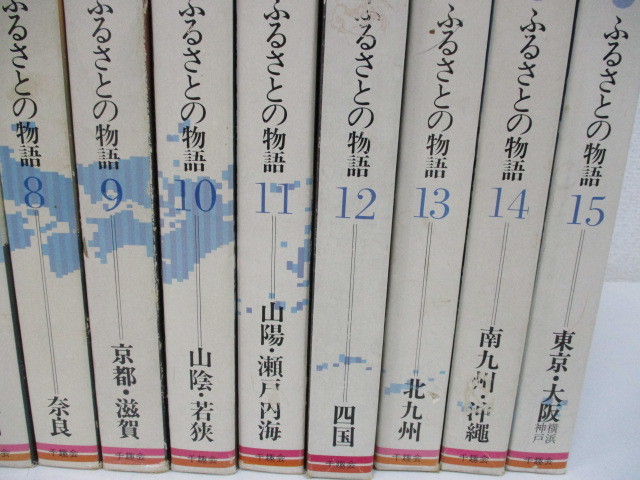
Identify the location of book 8. Image resolution: width=640 pixels, height=480 pixels. (29, 197).